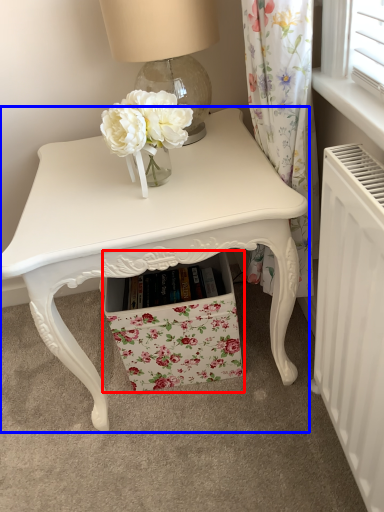
Question: Which object appears farthest to the camera in this image, drawer (highlighted by a red box) or table (highlighted by a blue box)?

Choices:
 (A) drawer
 (B) table

Answer: (A)